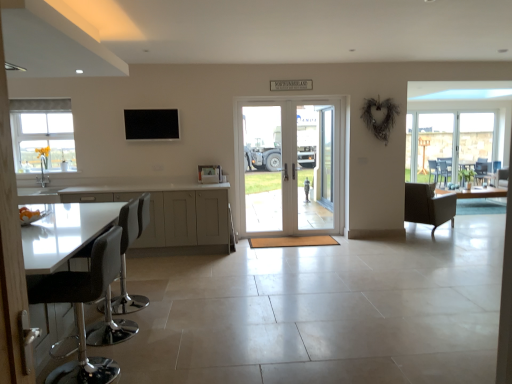
You are a GUI agent. You are given a task and a screenshot of the screen. Output one action in this format:
    pyautogui.click(x=<x>, y=<y>)
    Task: Click on the vacant space behind black leather stool at lower left, marked as the second chair in a right-to-left arrangement
    The width and height of the screenshot is (512, 384).
    Given the screenshot: What is the action you would take?
    pyautogui.click(x=127, y=345)